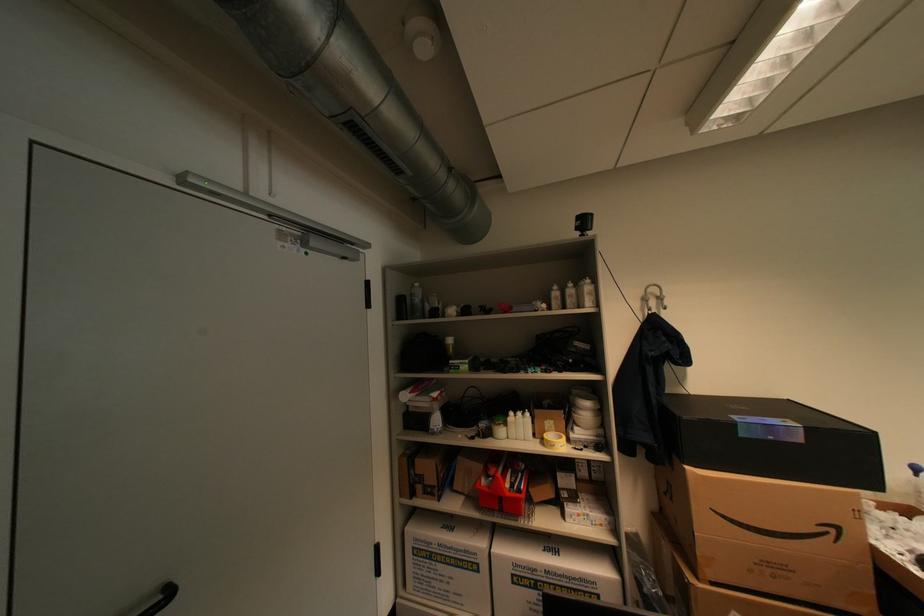
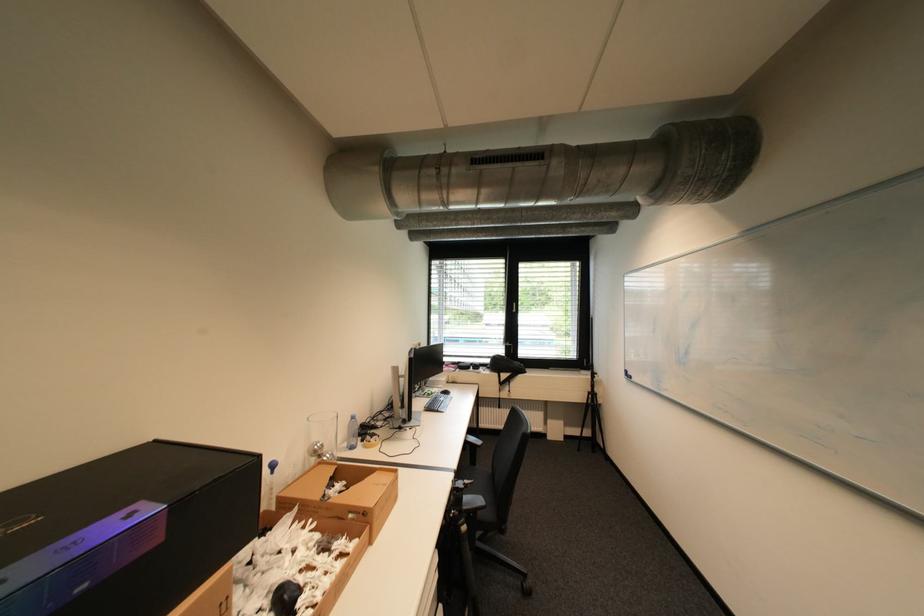
Question: Based on the continuous images, in which direction is the camera rotating? Reply with the corresponding letter.

Choices:
 (A) Left
 (B) Right
 (C) Up
 (D) Down

Answer: (B)